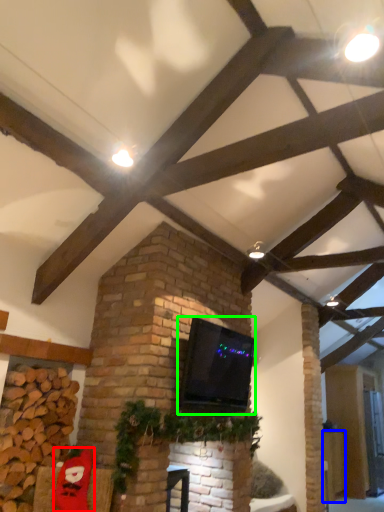
Question: Considering the real-world distances, which object is farthest from santa claus (highlighted by a red box)? furniture (highlighted by a blue box) or wide (highlighted by a green box)?

Choices:
 (A) furniture
 (B) wide

Answer: (A)